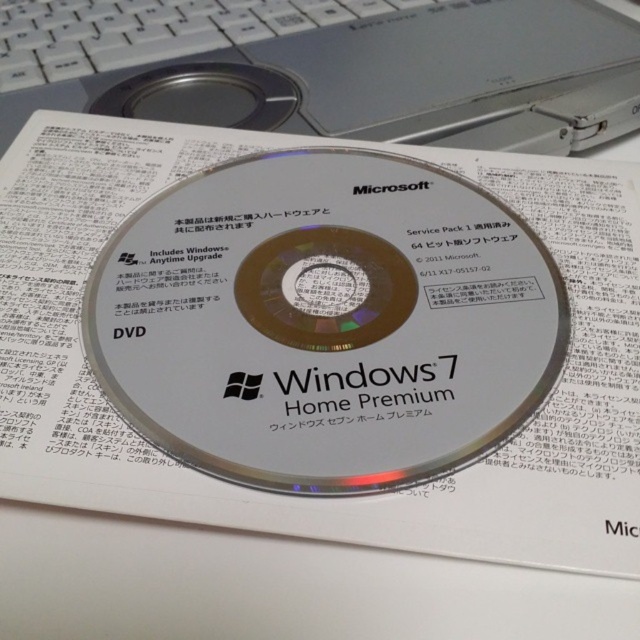
You are trying to determine if the transparent plastic dvd at center can fit into the DVD drive of the silver metallic laptop at center. Based on their sizes, will it fit?

The transparent plastic dvd at center is bigger than silver metallic laptop at center, so it will not fit into the DVD drive of the silver metallic laptop at center.

You are designing a layout for a new DVD packaging. The existing design has a transparent plastic DVD at center. Where exactly should you position the DVD in the new design to maintain alignment with the original?

The transparent plastic dvd at center should be positioned at point (324, 321) to maintain alignment with the original.

You are looking at the DVD packaging and notice two points marked on it. The first point is at coordinate point (305, 369) and the second is at point (141, 42). Which point is closer to you?

Point (305, 369) is closer to the viewer than point (141, 42).